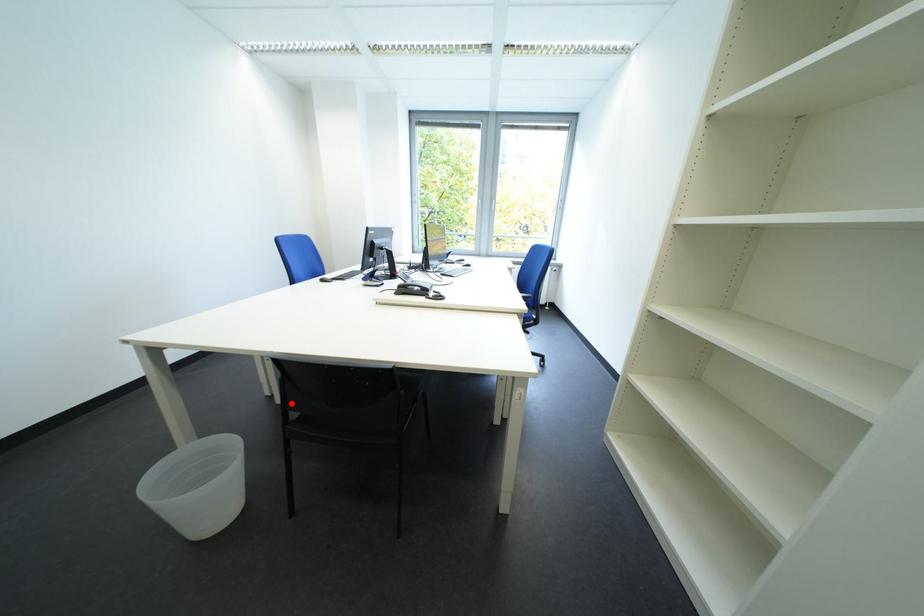
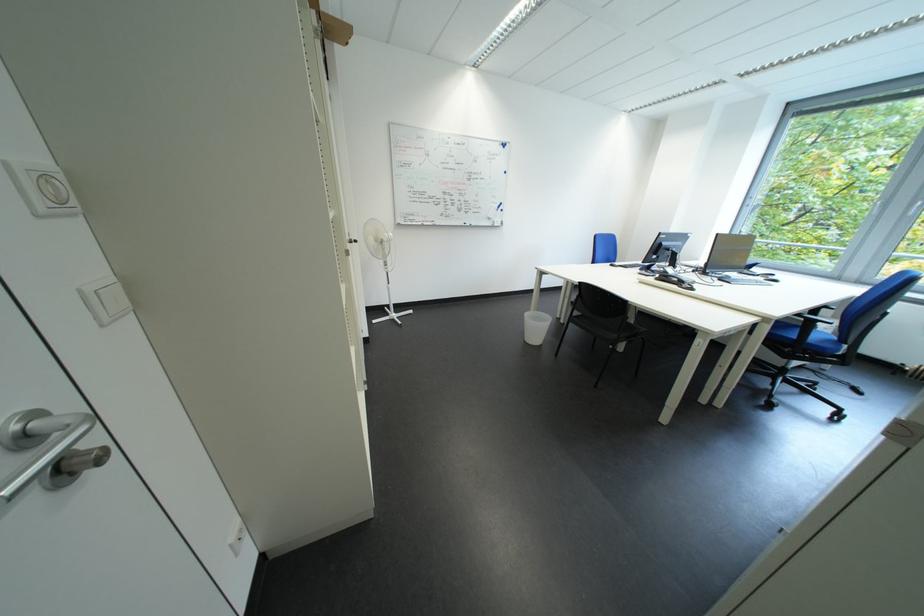
In the second image, find the point that corresponds to the highlighted location in the first image.

(575, 323)